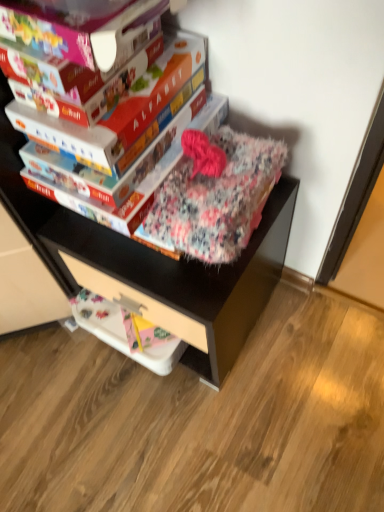
The width and height of the screenshot is (384, 512). What are the coordinates of `vacant space positioned to the left of fluffy fabric bag at upper center` in the screenshot? It's located at click(52, 379).